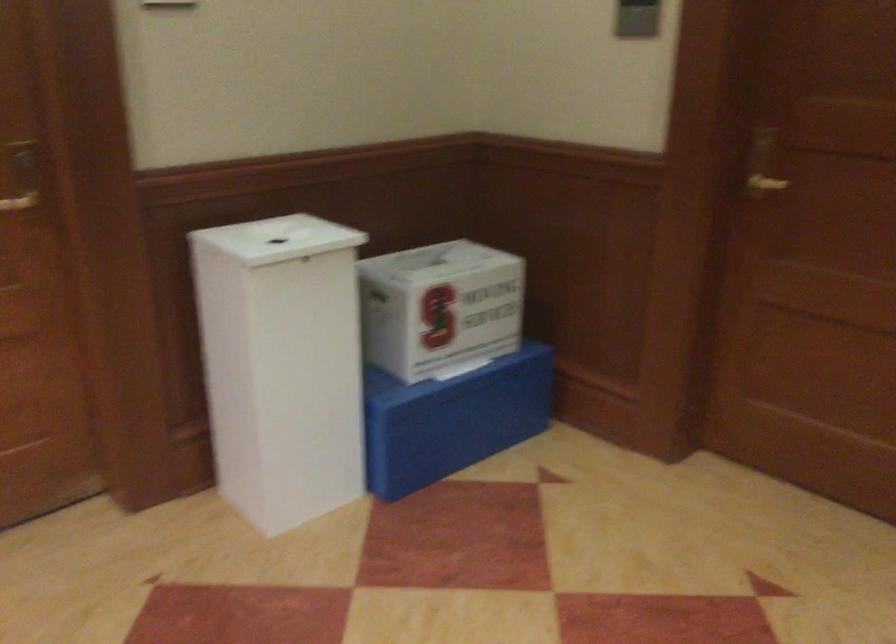
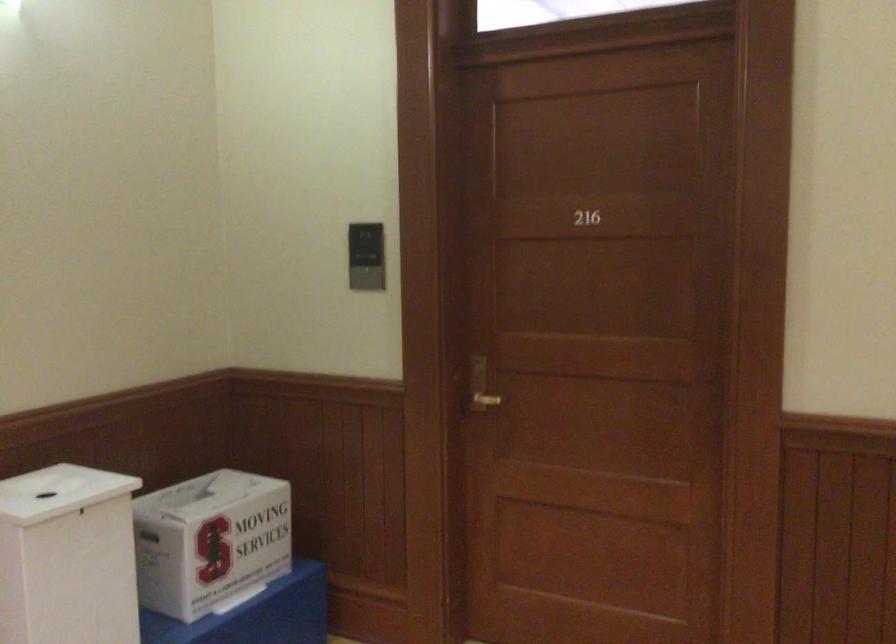
Question: The camera is either moving clockwise (left) or counter-clockwise (right) around the object. The first image is from the beginning of the video and the second image is from the end. Is the camera moving left or right when shooting the video?

Choices:
 (A) Left
 (B) Right

Answer: (A)